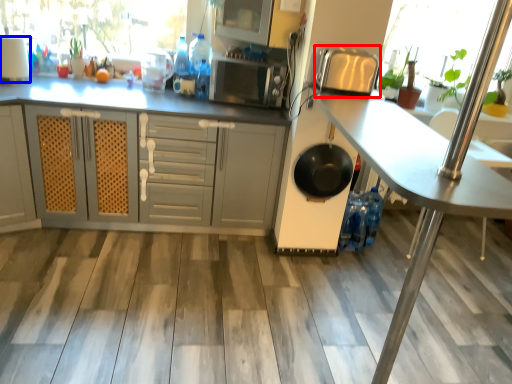
Question: Which point is closer to the camera, appliance (highlighted by a red box) or appliance (highlighted by a blue box)?

Choices:
 (A) appliance
 (B) appliance

Answer: (A)